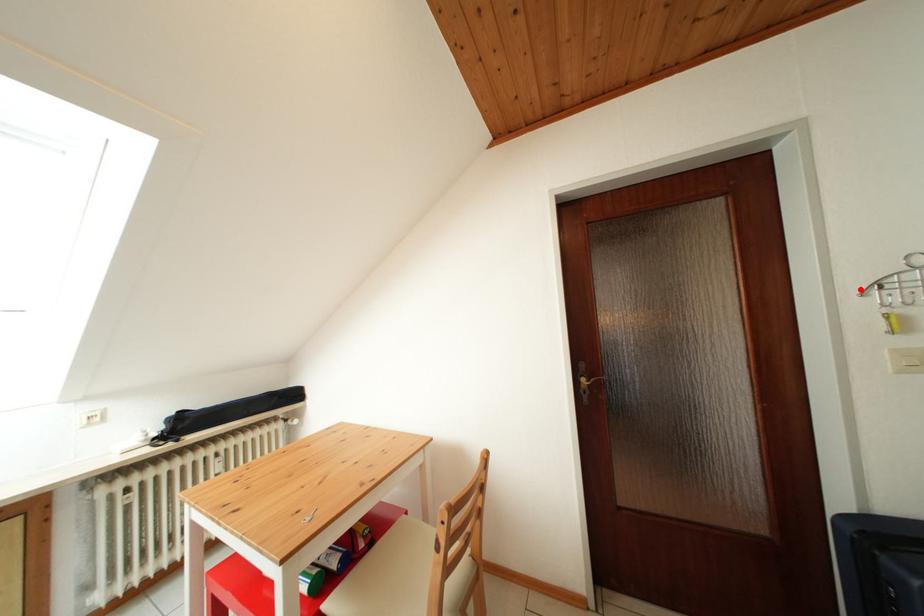
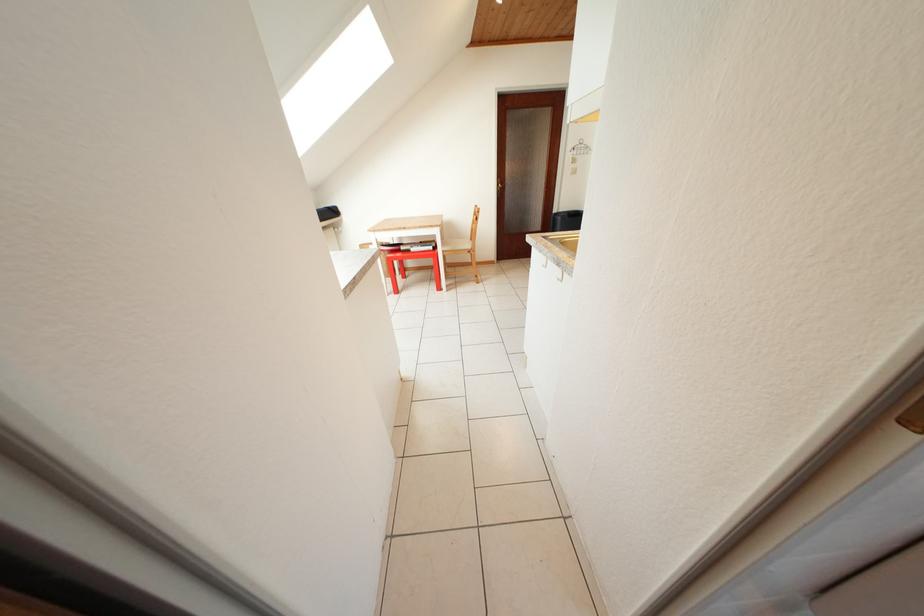
Where in the second image is the point corresponding to the highlighted location from the first image?

(578, 153)